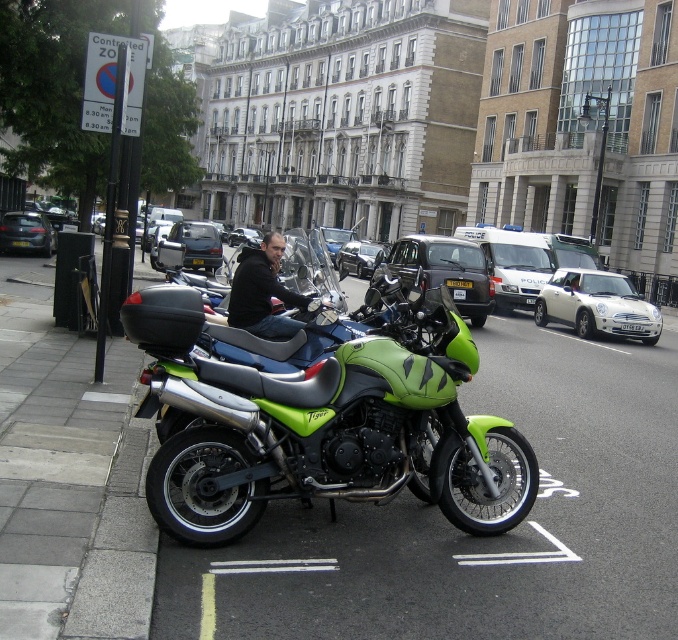
Is matte black car at left positioned in front of black plastic license plate at center?

No.

Between point (16, 237) and point (450, 285), which one is positioned behind?

Point (16, 237)

Find the location of a particular element. matte black car at left is located at coordinates (26, 232).

Does gray concrete curb at lower left lie in front of black plastic license plate at center?

Yes.

Who is shorter, gray concrete curb at lower left or black plastic license plate at center?

With less height is black plastic license plate at center.

Does point (129, 449) lie in front of point (462, 284)?

Yes, point (129, 449) is closer to viewer.

At what (x,y) coordinates should I click in order to perform the action: click on gray concrete curb at lower left. Please return your answer as a coordinate pair (x, y). This screenshot has width=678, height=640. Looking at the image, I should click on (119, 548).

Which of these two, white matte car at center-right or dark gray metallic car at center, stands shorter?

white matte car at center-right

Does white matte car at center-right have a smaller size compared to dark gray metallic car at center?

Indeed, white matte car at center-right has a smaller size compared to dark gray metallic car at center.

What do you see at coordinates (595, 305) in the screenshot? The height and width of the screenshot is (640, 678). I see `white matte car at center-right` at bounding box center [595, 305].

Where is `white matte car at center-right`? The width and height of the screenshot is (678, 640). white matte car at center-right is located at coordinates (595, 305).